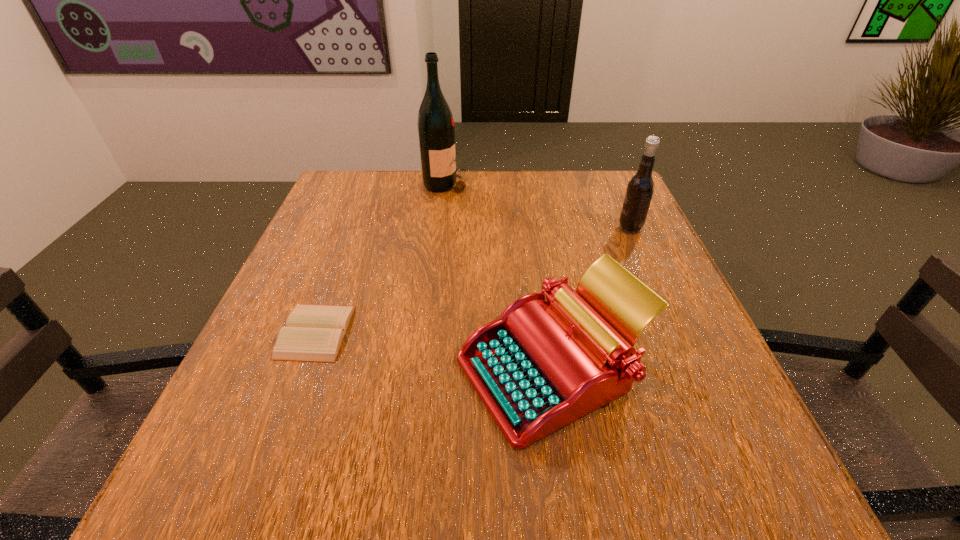
I want to click on object at the near right corner, so click(x=540, y=366).

In the image, there is a desktop. Where is `free space at the far edge`? Image resolution: width=960 pixels, height=540 pixels. free space at the far edge is located at coordinates (531, 187).

Identify the location of vacant space at the near edge. The width and height of the screenshot is (960, 540). (563, 447).

The height and width of the screenshot is (540, 960). I want to click on free region at the left edge of the desktop, so click(x=332, y=271).

Where is `free space at the right edge of the desktop`? The image size is (960, 540). free space at the right edge of the desktop is located at coordinates (626, 250).

The width and height of the screenshot is (960, 540). Find the location of `vacant region at the far left corner of the desktop`. vacant region at the far left corner of the desktop is located at coordinates (355, 199).

You are a GUI agent. You are given a task and a screenshot of the screen. Output one action in this format:
    pyautogui.click(x=<x>, y=<y>)
    Task: Click on the free space at the near left corner
    The width and height of the screenshot is (960, 540).
    Given the screenshot: What is the action you would take?
    pyautogui.click(x=234, y=449)

Identify the location of free location at the near right corner. 782,512.

Find the location of a particular element. The width and height of the screenshot is (960, 540). empty space that is in between the second shortest object and the leftmost object is located at coordinates (434, 350).

Image resolution: width=960 pixels, height=540 pixels. I want to click on free space between the leftmost object and the second shortest object, so click(x=434, y=350).